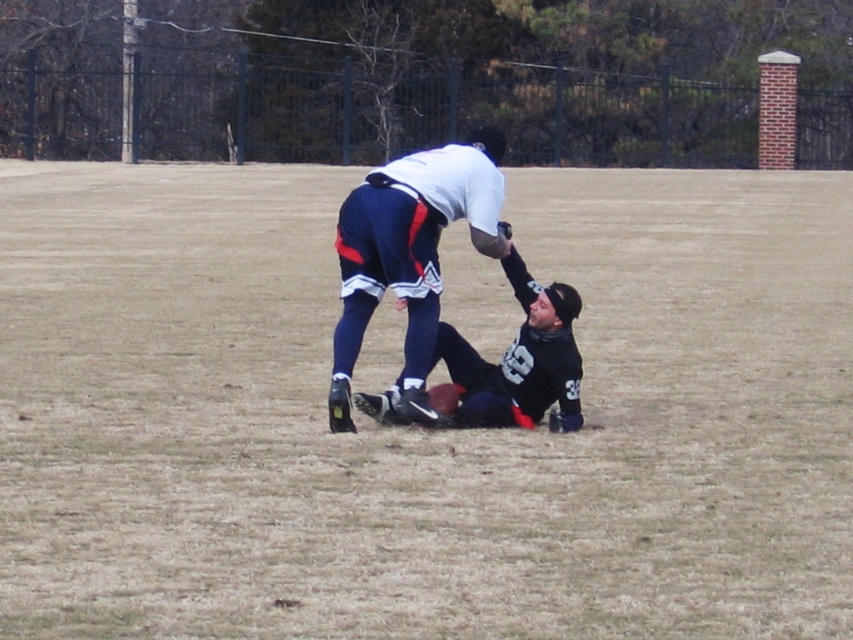
Can you confirm if brown grass at center is shorter than black jersey at center?

No, brown grass at center is not shorter than black jersey at center.

Which is more to the left, brown grass at center or black jersey at center?

black jersey at center

The width and height of the screenshot is (853, 640). I want to click on brown grass at center, so pos(418,428).

Which is more to the left, white matte shirt at center or black jersey at center?

Positioned to the left is white matte shirt at center.

Between white matte shirt at center and black jersey at center, which one has more height?

white matte shirt at center is taller.

Who is more distant from viewer, (426, 339) or (532, 406)?

Positioned behind is point (532, 406).

The width and height of the screenshot is (853, 640). Identify the location of white matte shirt at center. (410, 253).

Does point (834, 237) come farther from viewer compared to point (346, 358)?

Yes, point (834, 237) is farther from viewer.

Does brown grass at center have a larger size compared to white matte shirt at center?

Yes.

Which is behind, point (138, 337) or point (409, 314)?

Positioned behind is point (138, 337).

Where is `brown grass at center`? The height and width of the screenshot is (640, 853). brown grass at center is located at coordinates (418, 428).